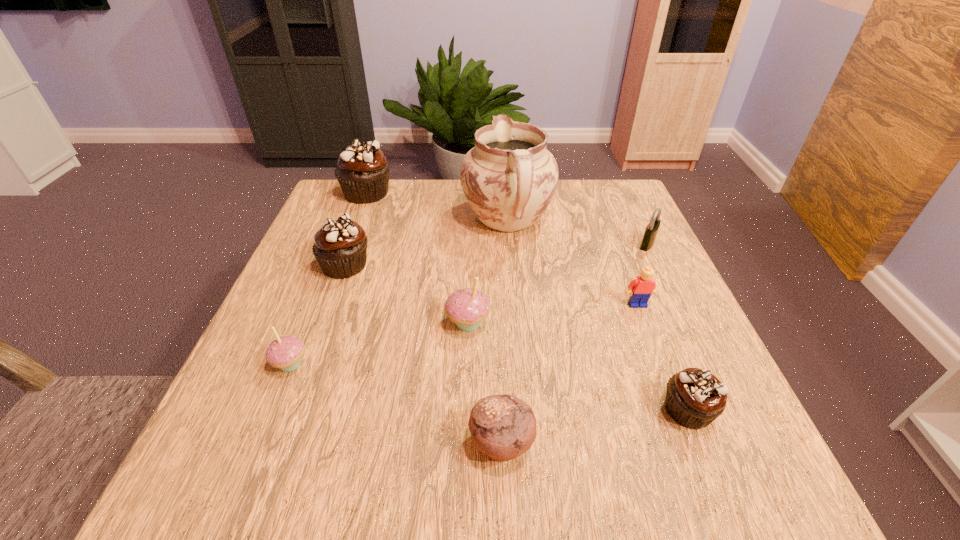
You are a GUI agent. You are given a task and a screenshot of the screen. Output one action in this format:
    pyautogui.click(x=<x>, y=<y>)
    Task: Click on the blank space located 0.090m on the right of the nearer pink cupcake
    Image resolution: width=960 pixels, height=540 pixels.
    Given the screenshot: What is the action you would take?
    pyautogui.click(x=360, y=364)

You are a GUI agent. You are given a task and a screenshot of the screen. Output one action in this format:
    pyautogui.click(x=<x>, y=<y>)
    Task: Click on the free point located 0.330m on the left of the rightmost brown cupcake
    This screenshot has height=540, width=960.
    Given the screenshot: What is the action you would take?
    pyautogui.click(x=455, y=410)

Identify the location of vacant space located 0.100m on the left of the muffin. The width and height of the screenshot is (960, 540). coord(402,443).

This screenshot has height=540, width=960. Find the location of `pitcher present at the far edge`. pitcher present at the far edge is located at coordinates (509, 178).

Where is `cupcake that is at the far edge`? This screenshot has height=540, width=960. cupcake that is at the far edge is located at coordinates (363, 170).

You are a GUI agent. You are given a task and a screenshot of the screen. Output one action in this format:
    pyautogui.click(x=<x>, y=<y>)
    Task: Click on the object at the near edge
    The width and height of the screenshot is (960, 540).
    Given the screenshot: What is the action you would take?
    pyautogui.click(x=503, y=427)

This screenshot has height=540, width=960. I want to click on padlock present at the right edge, so click(x=651, y=230).

Locate an element on the screen. Image resolution: width=960 pixels, height=540 pixels. Lego that is at the right edge is located at coordinates (642, 287).

The height and width of the screenshot is (540, 960). What are the coordinates of `cupcake present at the right edge` in the screenshot? It's located at (695, 398).

You are a GUI agent. You are given a task and a screenshot of the screen. Output one action in this format:
    pyautogui.click(x=<x>, y=<y>)
    Task: Click on the object that is positioned at the far left corner
    This screenshot has height=540, width=960.
    Given the screenshot: What is the action you would take?
    pyautogui.click(x=363, y=170)